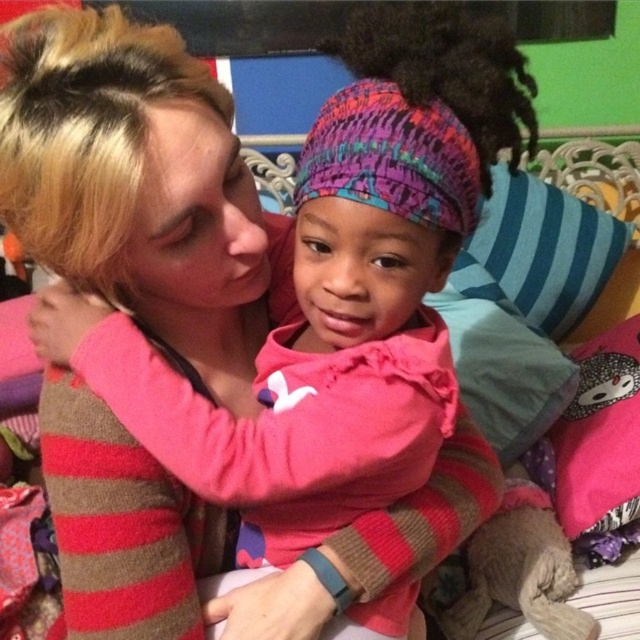
In the scene shown: Please provide the exact coordinates of the blue striped pillow at right in the image. The coordinates should be in the format of a point with two decimal places, like this example format point 0.395, 0.844. Please respond in the following JSON format, and do not include any other information besides the JSON object. Here is the JSON schema you must follow strictly to ensure accuracy. 2. The answer must be in JSON format as specified, containing only the required fields. 3. Do not add any extra text or exp

The blue striped pillow at right is located at point (x=540, y=252).

Looking at this image, you are a photographer standing in front of the scene described. You want to place a small 10 cm wide decorative item on the pink fleece at center so it appears the same size as the pillows in the background. Considering the distance, will the item look proportionally correct?

The pink fleece at center is 49.52 centimeters from viewer. Since the item is placed on the fleece, it will appear larger than the pillows in the background which are farther away. To maintain proportion, the item should be smaller than 10 cm.

You are standing in the room and want to place a small decoration between the two points, point (580, 253) and point (608, 452). Which point is closer to you so you can start placing the decoration from there?

Point (580, 253) is closer to you than point (608, 452), so you can start placing the decoration from there.